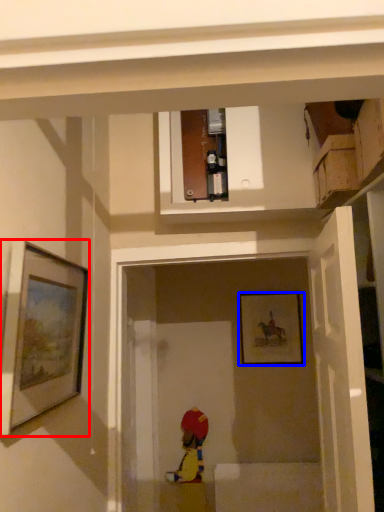
Question: Which object is closer to the camera taking this photo, picture frame (highlighted by a red box) or picture frame (highlighted by a blue box)?

Choices:
 (A) picture frame
 (B) picture frame

Answer: (A)